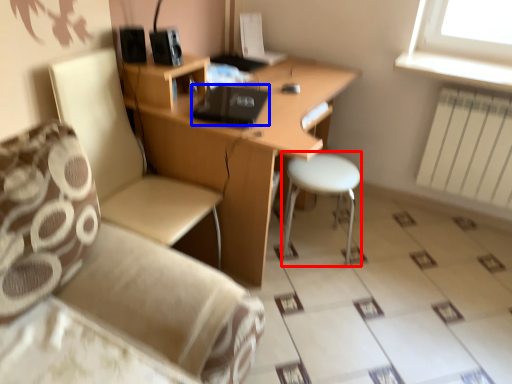
Question: Which object appears farthest to the camera in this image, bar stool (highlighted by a red box) or laptop (highlighted by a blue box)?

Choices:
 (A) bar stool
 (B) laptop

Answer: (A)